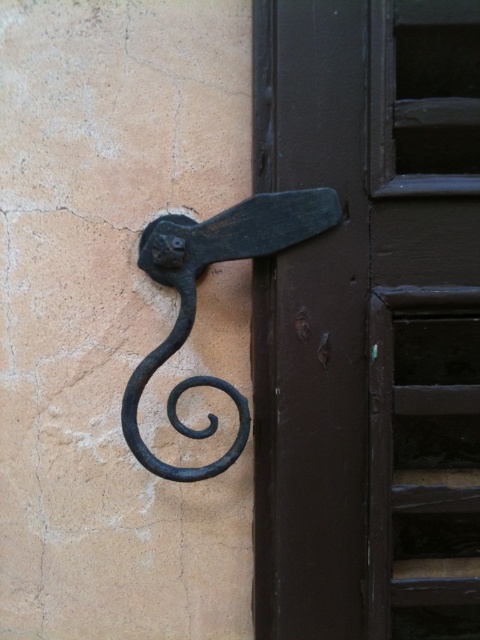
Based on the photo, you are trying to determine if a decorative metal plate that is 10 cm wide can fit horizontally on the dark brown wood door at center without overlapping the black wrought iron door handle at upper center. Can it fit?

The dark brown wood door at center is wider than the black wrought iron door handle at upper center. Since the door is wider, the 10 cm wide decorative metal plate can fit horizontally on the dark brown wood door at center without overlapping the handle.

You are a painter who needs to hang a picture frame that is 10 centimeters wide between the dark brown wood door at center and the black wrought iron door handle at upper center. Is there enough space to fit the frame without overlapping either object?

The dark brown wood door at center and black wrought iron door handle at upper center are 8.44 centimeters apart. Since the picture frame is 10 centimeters wide, which is wider than the space between them, there is not enough space to fit the frame without overlapping either object.